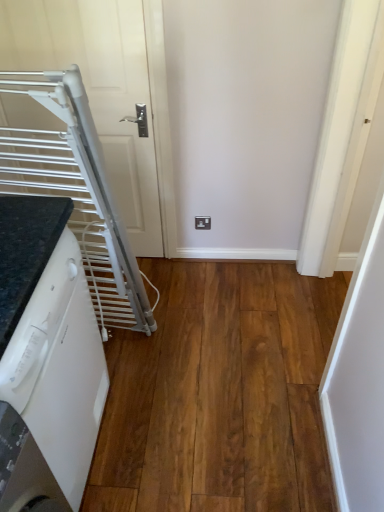
Question: Considering the relative positions of brown wood flooring at lower left and white glossy dishwasher at lower left in the image provided, is brown wood flooring at lower left in front of white glossy dishwasher at lower left?

Choices:
 (A) yes
 (B) no

Answer: (B)

Question: Is brown wood flooring at lower left taller than white glossy dishwasher at lower left?

Choices:
 (A) yes
 (B) no

Answer: (B)

Question: From the image's perspective, is brown wood flooring at lower left on top of white glossy dishwasher at lower left?

Choices:
 (A) no
 (B) yes

Answer: (A)

Question: Can you confirm if brown wood flooring at lower left is shorter than white glossy dishwasher at lower left?

Choices:
 (A) no
 (B) yes

Answer: (B)

Question: Is brown wood flooring at lower left outside of white glossy dishwasher at lower left?

Choices:
 (A) yes
 (B) no

Answer: (A)

Question: From a real-world perspective, is brown wood flooring at lower left located beneath white glossy dishwasher at lower left?

Choices:
 (A) no
 (B) yes

Answer: (B)

Question: Is white matte door at upper left shorter than white glossy dishwasher at lower left?

Choices:
 (A) yes
 (B) no

Answer: (B)

Question: Is white matte door at upper left oriented towards white glossy dishwasher at lower left?

Choices:
 (A) no
 (B) yes

Answer: (B)

Question: Considering the relative sizes of white matte door at upper left and white glossy dishwasher at lower left in the image provided, is white matte door at upper left taller than white glossy dishwasher at lower left?

Choices:
 (A) yes
 (B) no

Answer: (A)

Question: Does white matte door at upper left appear on the left side of white glossy dishwasher at lower left?

Choices:
 (A) yes
 (B) no

Answer: (B)

Question: From the image's perspective, is white matte door at upper left located beneath white glossy dishwasher at lower left?

Choices:
 (A) yes
 (B) no

Answer: (B)

Question: Considering the relative sizes of white matte door at upper left and white glossy dishwasher at lower left in the image provided, is white matte door at upper left thinner than white glossy dishwasher at lower left?

Choices:
 (A) yes
 (B) no

Answer: (A)

Question: From the image's perspective, is brown wood flooring at lower left beneath white matte door at upper left?

Choices:
 (A) no
 (B) yes

Answer: (B)